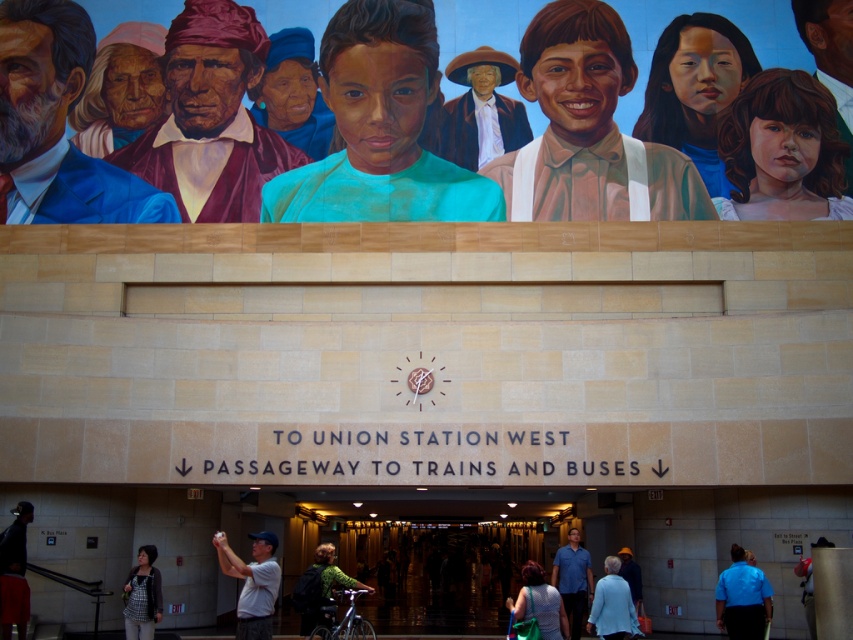
Question: Is matte brown shirt at center to the left of dark blue shirt at lower left from the viewer's perspective?

Choices:
 (A) yes
 (B) no

Answer: (B)

Question: Among these objects, which one is farthest from the camera?

Choices:
 (A) matte brown hat at center
 (B) matte brown shirt at center
 (C) light blue shirt at lower left
 (D) dark blue shirt at lower left

Answer: (A)

Question: Is teal matte shirt at center smaller than matte blue suit at upper left?

Choices:
 (A) no
 (B) yes

Answer: (B)

Question: Which of the following is the farthest from the observer?

Choices:
 (A) matte brown shirt at center
 (B) matte brown hat at center
 (C) teal matte shirt at center

Answer: (B)

Question: Can you confirm if matte maroon shirt at center-left is bigger than dark blue shirt at lower left?

Choices:
 (A) yes
 (B) no

Answer: (A)

Question: Which point appears closest to the camera in this image?

Choices:
 (A) (625, 205)
 (B) (186, 6)
 (C) (38, 72)

Answer: (A)